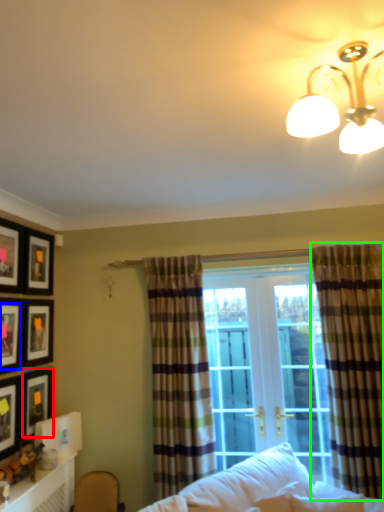
Question: Which is nearer to the picture frame (highlighted by a red box)? picture frame (highlighted by a blue box) or curtain (highlighted by a green box).

Choices:
 (A) picture frame
 (B) curtain

Answer: (A)